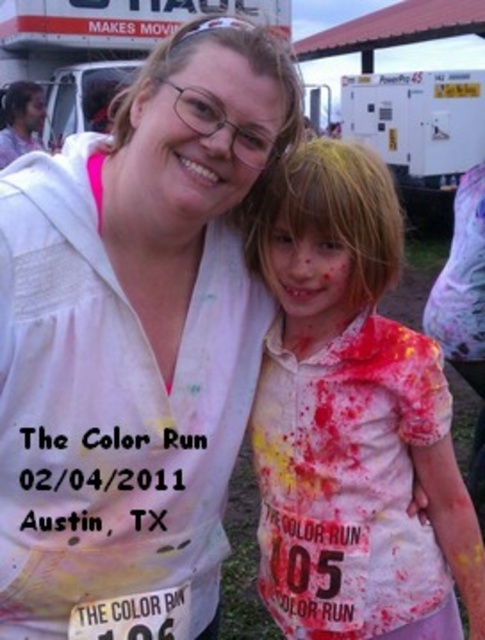
You are a photographer at The Color Run event. You want to capture a photo of the speckled paint shirt at center and the matte white face at center. Your camera has a minimum focus distance of 12 inches. Can you take a photo of both subjects without moving the camera?

The distance between the speckled paint shirt at center and the matte white face at center is 14.20 inches, which is greater than the camera minimum focus distance of 12 inches. Therefore, you can take a photo of both subjects without moving the camera.

You are a photographer at The Color Run event. You want to take a photo focusing on the two points in the scene. Which point, point (213, 509) or point (147, 157), is closer to your camera?

Point (147, 157) is closer to the camera because it is stated that point (213, 509) is further away than point (147, 157).

The scene shows two participants at The Color Run in Austin, Texas. The adult is wearing a white shirt with the event logo and date, and the child has a number pinned on their shirt. Which participant has their shirt represented by the point at coordinates (x=134, y=333)?

The white matte shirt at upper left is represented by point (x=134, y=333), so the adult wearing the white shirt with the event logo and date has their shirt represented by that point.